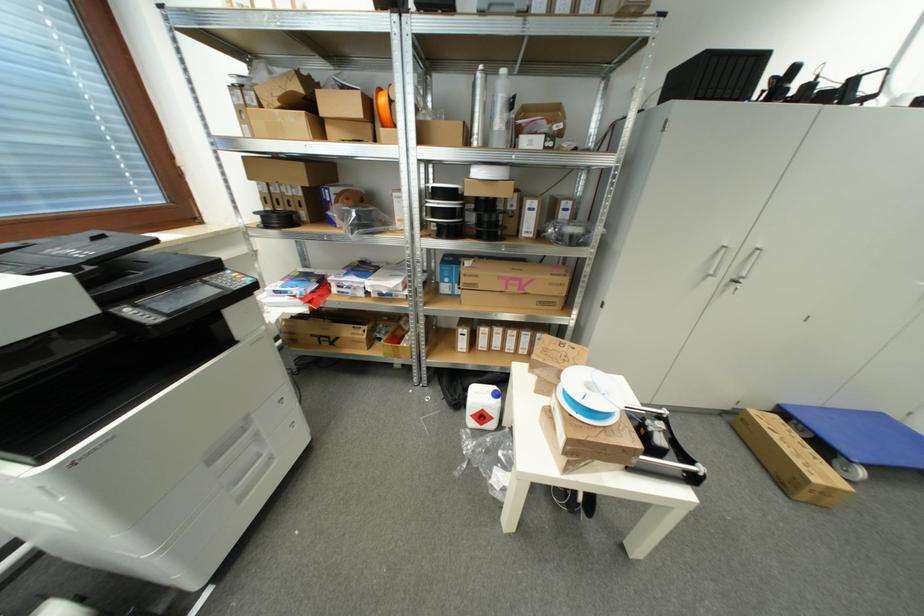
Find where to lift the blue filament spool. Please return your answer as a coordinate pair (x, y).

(590, 395)